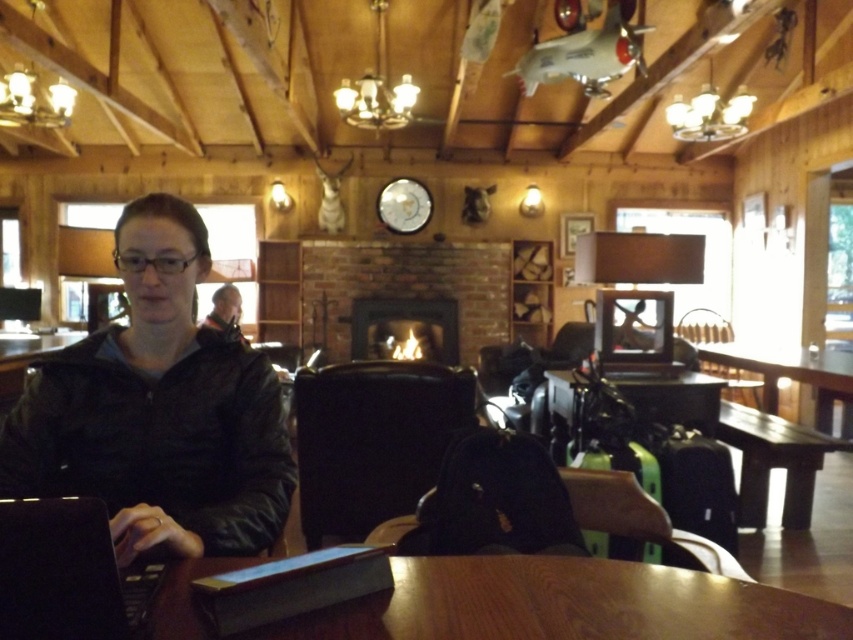
Question: Can you confirm if matte black jacket at left is thinner than black matte laptop at lower left?

Choices:
 (A) yes
 (B) no

Answer: (B)

Question: Among these points, which one is farthest from the camera?

Choices:
 (A) (160, 579)
 (B) (62, 371)

Answer: (B)

Question: Is matte black jacket at left wider than smooth brown leather jacket at center?

Choices:
 (A) yes
 (B) no

Answer: (A)

Question: Is matte black jacket at left bigger than smooth brown leather jacket at center?

Choices:
 (A) yes
 (B) no

Answer: (A)

Question: Which of the following is the closest to the observer?

Choices:
 (A) (64, 625)
 (B) (132, 406)
 (C) (764, 356)
 (D) (515, 577)

Answer: (A)

Question: Which is nearer to the wooden table at center?

Choices:
 (A) matte black jacket at left
 (B) brown wood table at lower center

Answer: (B)